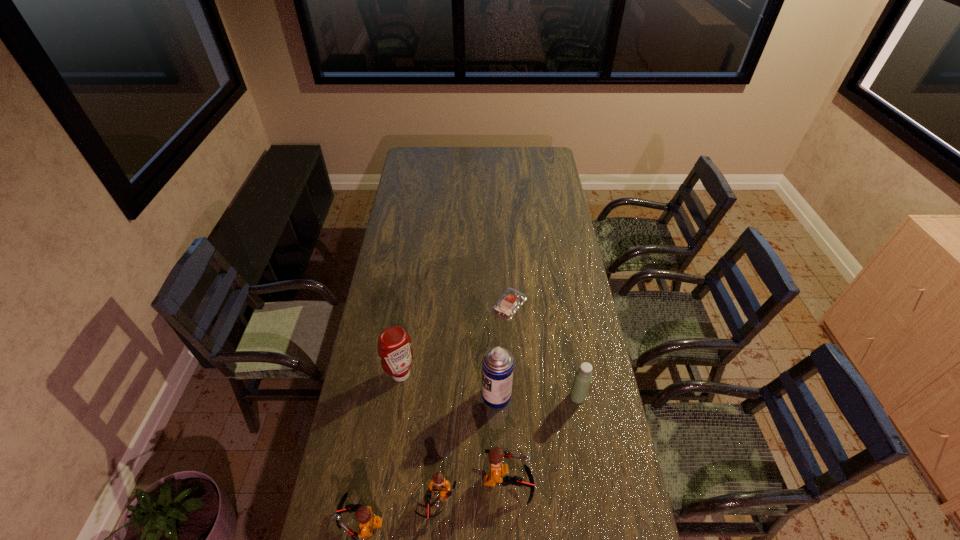
The height and width of the screenshot is (540, 960). Find the location of `the fifth object from right to left`. the fifth object from right to left is located at coordinates (439, 484).

Find the location of a particular element. This screenshot has height=540, width=960. the shortest Lego is located at coordinates (439, 484).

Where is `the rightmost Lego`? The image size is (960, 540). the rightmost Lego is located at coordinates (497, 469).

You are a GUI agent. You are given a task and a screenshot of the screen. Output one action in this format:
    pyautogui.click(x=<x>, y=<y>)
    Task: Click on the farthest object
    
    Given the screenshot: What is the action you would take?
    pyautogui.click(x=508, y=304)

This screenshot has height=540, width=960. Identify the location of steak. [508, 304].

Where is `the second tallest object`? the second tallest object is located at coordinates (394, 343).

You are a GUI agent. You are given a task and a screenshot of the screen. Output one action in this format:
    pyautogui.click(x=<x>, y=<y>)
    Task: Click on the aerosol can
    
    Given the screenshot: What is the action you would take?
    pyautogui.click(x=497, y=363)

You are a GUI agent. You are given a task and a screenshot of the screen. Output one action in this format:
    pyautogui.click(x=<x>, y=<y>)
    Task: Click on the thermos bottle
    This screenshot has height=540, width=960.
    Given the screenshot: What is the action you would take?
    pyautogui.click(x=583, y=377)

In order to click on free space located 0.220m holding a crossbow in the hands of the rightmost Lego in this screenshot , I will do `click(605, 482)`.

The width and height of the screenshot is (960, 540). Identify the location of free region located on the left of the shortest object. (457, 305).